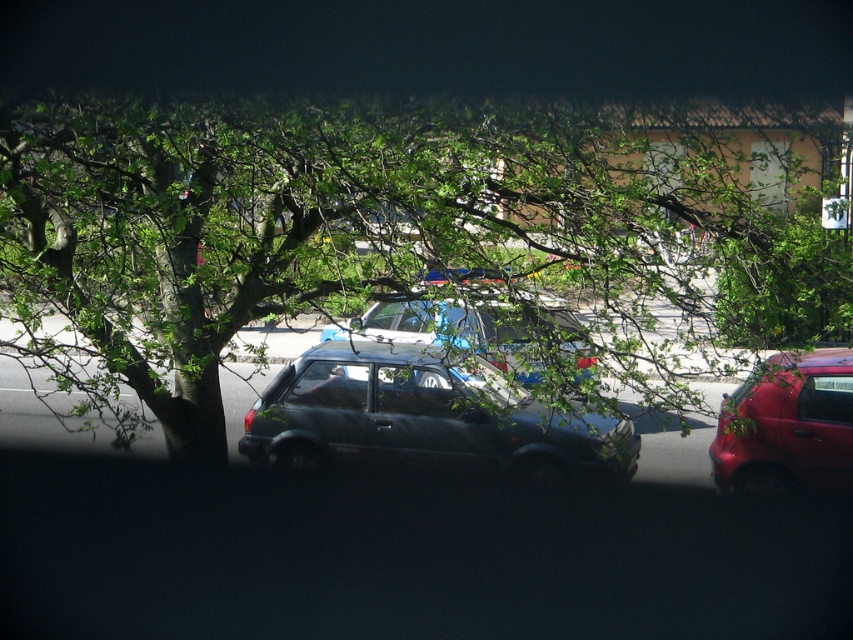
Question: Does green leafy tree at center have a larger size compared to metallic blue car at center?

Choices:
 (A) no
 (B) yes

Answer: (A)

Question: Is shiny black minivan at center bigger than metallic blue car at center?

Choices:
 (A) yes
 (B) no

Answer: (B)

Question: Which object is farther from the camera taking this photo?

Choices:
 (A) shiny black minivan at center
 (B) green leafy tree at center

Answer: (A)

Question: Can you confirm if metallic blue car at center is bigger than white plastic license plate at center?

Choices:
 (A) yes
 (B) no

Answer: (A)

Question: Which object is closer to the camera taking this photo?

Choices:
 (A) shiny black minivan at center
 (B) white plastic license plate at center

Answer: (A)

Question: Which object is positioned closest to the green leafy tree at center?

Choices:
 (A) shiny black minivan at center
 (B) shiny red car at right

Answer: (A)